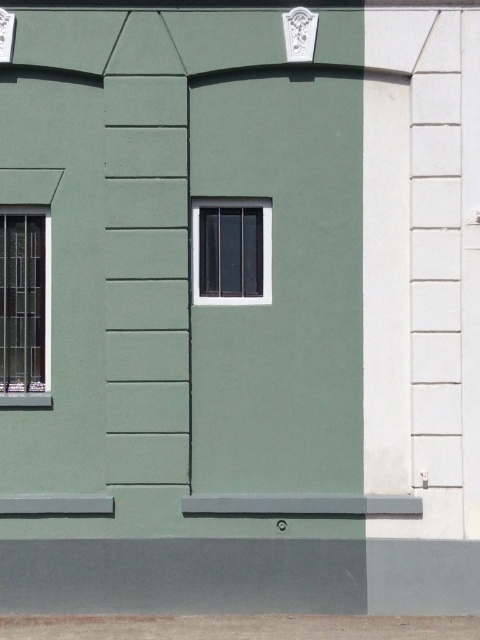
You are standing at the point with coordinates point (236, 292). You want to move to point (8, 220). Is there any obstacle between you and your destination?

Point (8, 220) is behind point (236, 292), so there is an obstacle between them.

You are a window installer assessing the exterior wall. You need to determine if the metallic grid window at left can accommodate a larger custom frame than the matte black window at center. Based on the scene, what can you conclude?

The metallic grid window at left is bigger than the matte black window at center, so it can accommodate a larger custom frame.